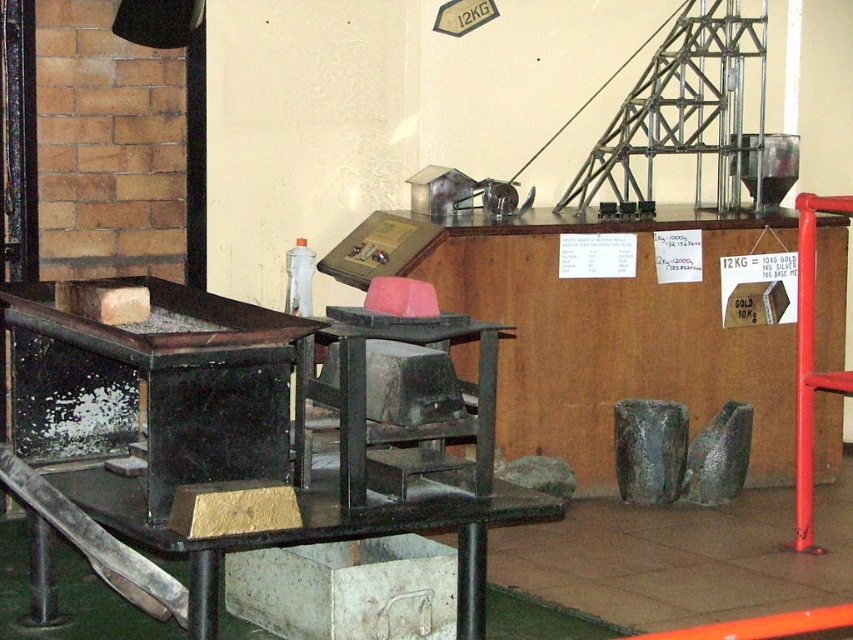
Who is lower down, black matte table at left or metallic gray table at lower left?

metallic gray table at lower left is below.

Who is more forward, (219, 477) or (94, 499)?

Point (219, 477)

Which is behind, point (134, 428) or point (199, 557)?

Point (134, 428)

Identify the location of black matte table at left. (155, 384).

Does metallic gray machine at center have a larger size compared to black matte table at left?

Yes, metallic gray machine at center is bigger than black matte table at left.

Does point (572, 324) lie in front of point (277, 310)?

No.

The image size is (853, 640). Describe the element at coordinates (596, 326) in the screenshot. I see `metallic gray machine at center` at that location.

Find the location of `metallic gray machine at center`. metallic gray machine at center is located at coordinates (596, 326).

Who is more forward, (361, 243) or (318, 538)?

Point (318, 538)

Can you confirm if metallic gray machine at center is positioned to the right of metallic gray table at lower left?

Correct, you'll find metallic gray machine at center to the right of metallic gray table at lower left.

Does point (416, 218) lie behind point (428, 516)?

Yes, it is behind point (428, 516).

Where is `metallic gray machine at center`? The height and width of the screenshot is (640, 853). metallic gray machine at center is located at coordinates (596, 326).